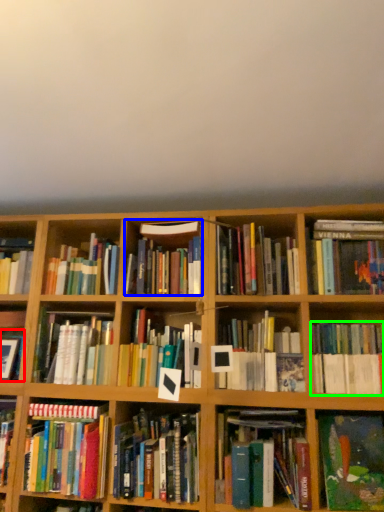
Question: Which object is the farthest from book (highlighted by a red box)? Choose among these: book (highlighted by a blue box) or book (highlighted by a green box).

Choices:
 (A) book
 (B) book

Answer: (B)